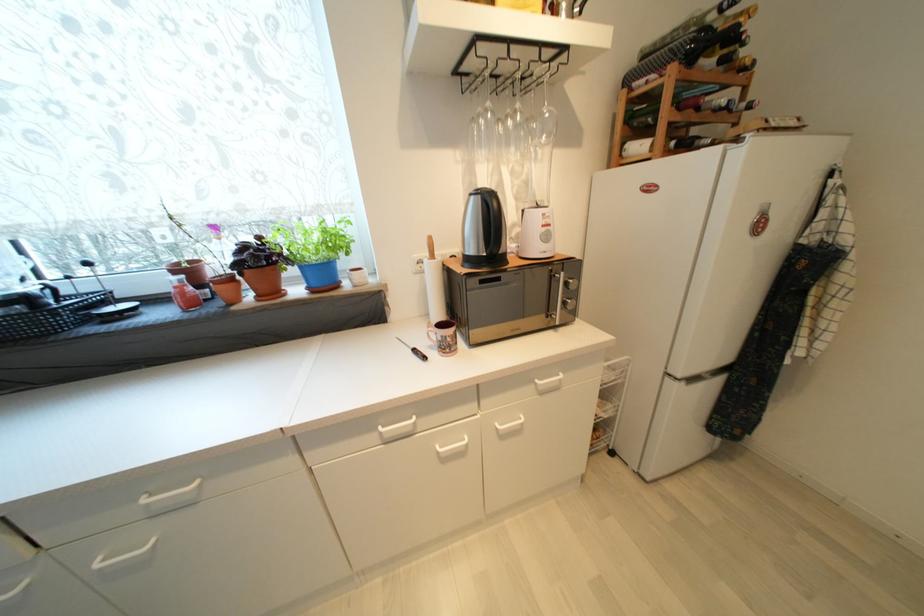
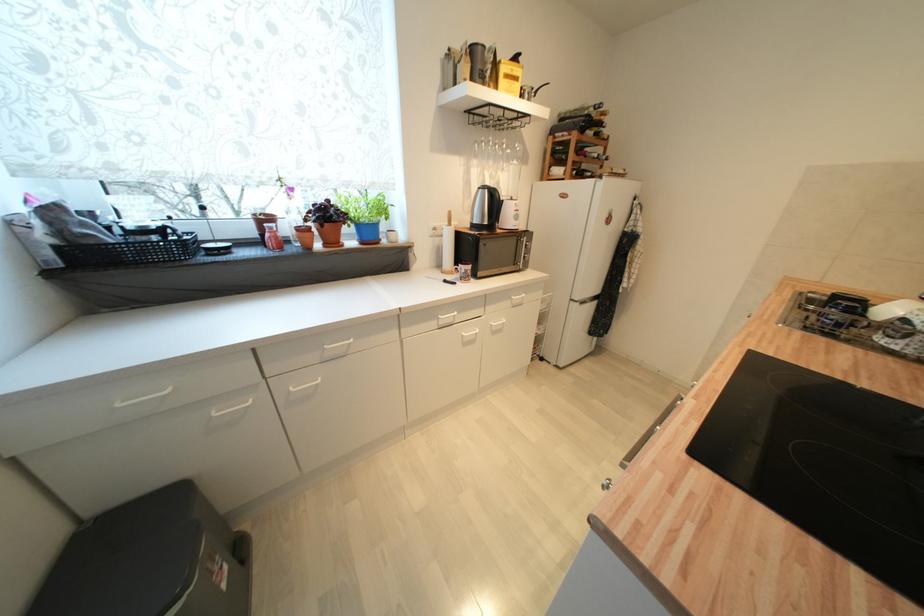
Locate, in the second image, the point that corresponds to (x=431, y=262) in the first image.

(450, 229)